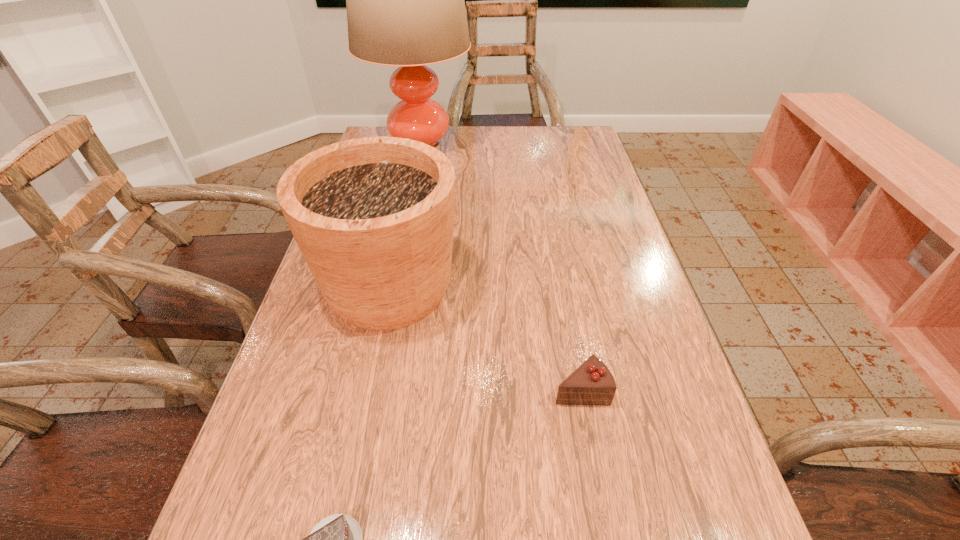
Identify the location of lamp that is at the left edge. (405, 0).

Find the location of a particular element. flowerpot present at the left edge is located at coordinates (373, 217).

Image resolution: width=960 pixels, height=540 pixels. In order to click on object that is at the right edge in this screenshot , I will do `click(592, 383)`.

In order to click on object located at the far left corner in this screenshot , I will do `click(405, 0)`.

Identify the location of blank area at the far edge. The image size is (960, 540). (480, 154).

In the image, there is a desktop. Where is `vacant space at the left edge`? This screenshot has height=540, width=960. vacant space at the left edge is located at coordinates (324, 441).

What are the coordinates of `free space at the right edge of the desktop` in the screenshot? It's located at (567, 176).

Find the location of `vacant space at the far right corner of the desktop`. vacant space at the far right corner of the desktop is located at coordinates (571, 160).

What are the coordinates of `unoccupied position between the farthest object and the right chocolate cake` in the screenshot? It's located at (500, 269).

What are the coordinates of `free space between the farther chocolate cake and the second farthest object` in the screenshot? It's located at (485, 338).